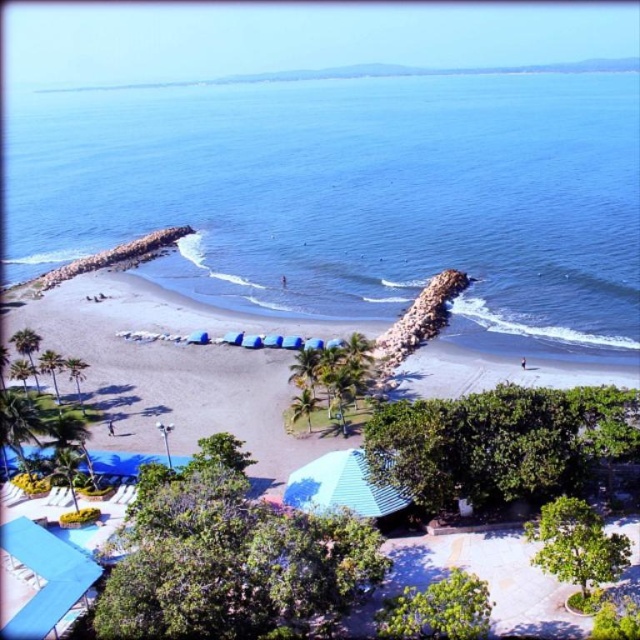
Question: Which point appears farthest from the camera in this image?

Choices:
 (A) (211, 392)
 (B) (401, 84)

Answer: (B)

Question: Is blue water at center in front of brown sandy beach at center?

Choices:
 (A) no
 (B) yes

Answer: (A)

Question: Can you confirm if blue water at center is positioned to the left of brown sandy beach at center?

Choices:
 (A) yes
 (B) no

Answer: (B)

Question: Among these objects, which one is farthest from the camera?

Choices:
 (A) brown sandy beach at center
 (B) blue water at center

Answer: (B)

Question: Which of the following is the farthest from the observer?

Choices:
 (A) brown sandy beach at center
 (B) blue water at center

Answer: (B)

Question: Does blue water at center have a lesser width compared to brown sandy beach at center?

Choices:
 (A) yes
 (B) no

Answer: (B)